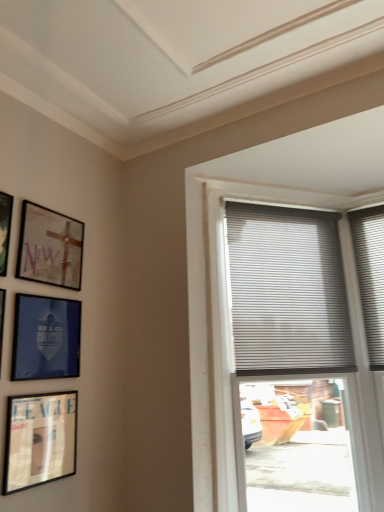
I want to click on free spot above gray pleated blinds at upper right (from a real-world perspective), so click(268, 206).